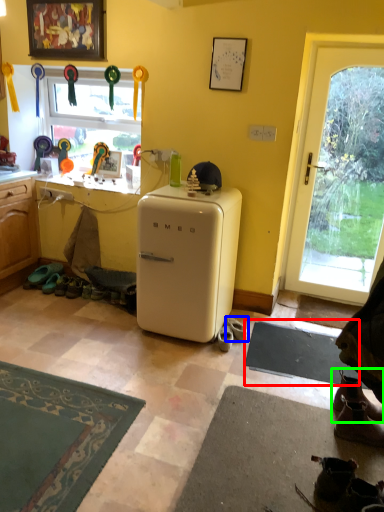
Question: Which object is positioned closest to yoga mat (highlighted by a red box)? Select from footwear (highlighted by a blue box) and footwear (highlighted by a green box).

Choices:
 (A) footwear
 (B) footwear

Answer: (A)